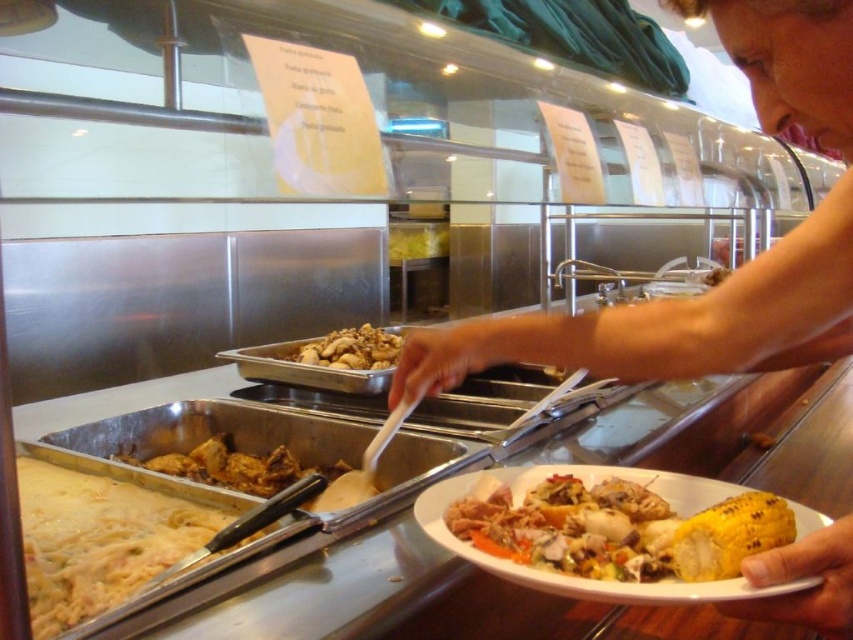
Can you confirm if smooth skin hand at center right is positioned below golden brown crispy chicken at center?

No.

Is smooth skin hand at center right to the right of golden brown crispy chicken at center from the viewer's perspective?

Correct, you'll find smooth skin hand at center right to the right of golden brown crispy chicken at center.

Does point (846, 346) come closer to viewer compared to point (329, 480)?

Yes, point (846, 346) is in front of point (329, 480).

What are the coordinates of `smooth skin hand at center right` in the screenshot? It's located at (735, 269).

Does smooth skin hand at center right have a larger size compared to white creamy pasta at left?

Yes, smooth skin hand at center right is bigger than white creamy pasta at left.

Is smooth skin hand at center right wider than white creamy pasta at left?

Indeed, smooth skin hand at center right has a greater width compared to white creamy pasta at left.

At what (x,y) coordinates should I click in order to perform the action: click on smooth skin hand at center right. Please return your answer as a coordinate pair (x, y). The height and width of the screenshot is (640, 853). Looking at the image, I should click on (735, 269).

Locate an element on the screen. The height and width of the screenshot is (640, 853). smooth skin hand at center right is located at coordinates (735, 269).

Is white creamy pasta at left to the right of brown matte chicken at center from the viewer's perspective?

Incorrect, white creamy pasta at left is not on the right side of brown matte chicken at center.

Does point (62, 524) come in front of point (363, 346)?

Yes.

What do you see at coordinates (97, 540) in the screenshot? I see `white creamy pasta at left` at bounding box center [97, 540].

At what (x,y) coordinates should I click in order to perform the action: click on white creamy pasta at left. Please return your answer as a coordinate pair (x, y). The image size is (853, 640). Looking at the image, I should click on (97, 540).